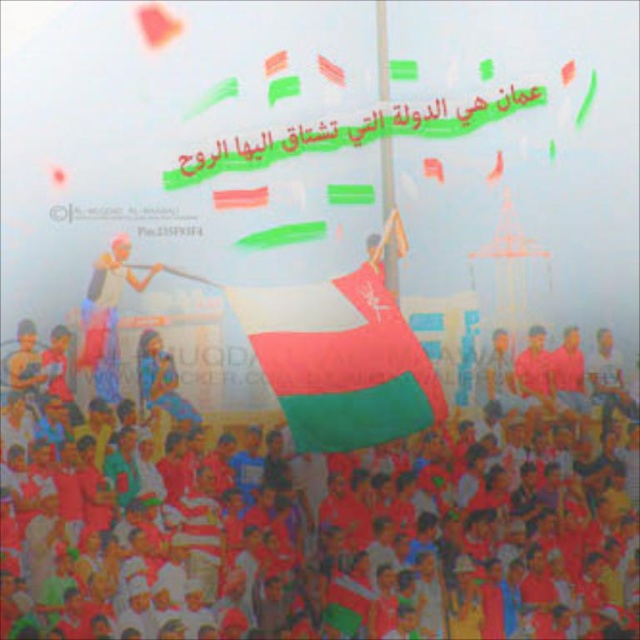
Based on the scene description, what is the significance of the point at coordinates (340, 362)?

The point at coordinates (340, 362) corresponds to the white fabric flag at center, which is central to the Omani cultural or national pride event depicted in the scene.

Based on the scene description, where exactly is the white fabric flag at center located in terms of coordinates?

The white fabric flag at center is located at point [340,362].